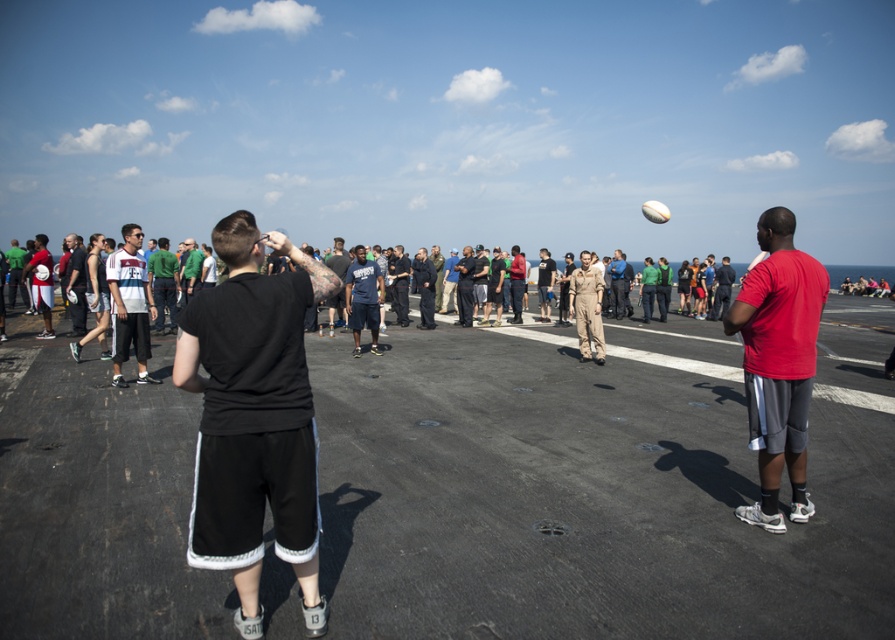
Is point (749, 444) closer to camera compared to point (130, 252)?

Yes, it is.

Between red matte shirt at right and white matte shirt at left, which one has more height?

red matte shirt at right

Does point (774, 456) come farther from viewer compared to point (143, 330)?

No, it is in front of (143, 330).

Where is `red matte shirt at right`? red matte shirt at right is located at coordinates (778, 362).

Is point (330, 336) behind point (189, 280)?

Yes, point (330, 336) is behind point (189, 280).

Looking at this image, between dark blue t-shirt at center and green fabric shirt at center, which one appears on the right side from the viewer's perspective?

From the viewer's perspective, dark blue t-shirt at center appears more on the right side.

Does point (345, 272) lie behind point (195, 256)?

No, it is in front of (195, 256).

Find the location of a particular element. The image size is (895, 640). dark blue t-shirt at center is located at coordinates (338, 259).

Based on the photo, is white matte shirt at left shorter than dark blue t-shirt at center?

Yes.

Does white matte shirt at left appear on the right side of dark blue t-shirt at center?

Incorrect, white matte shirt at left is not on the right side of dark blue t-shirt at center.

Is point (120, 317) farther from camera compared to point (331, 256)?

No, (120, 317) is closer to viewer.

At what (x,y) coordinates should I click in order to perform the action: click on white matte shirt at left. Please return your answer as a coordinate pair (x, y). The width and height of the screenshot is (895, 640). Looking at the image, I should click on (129, 305).